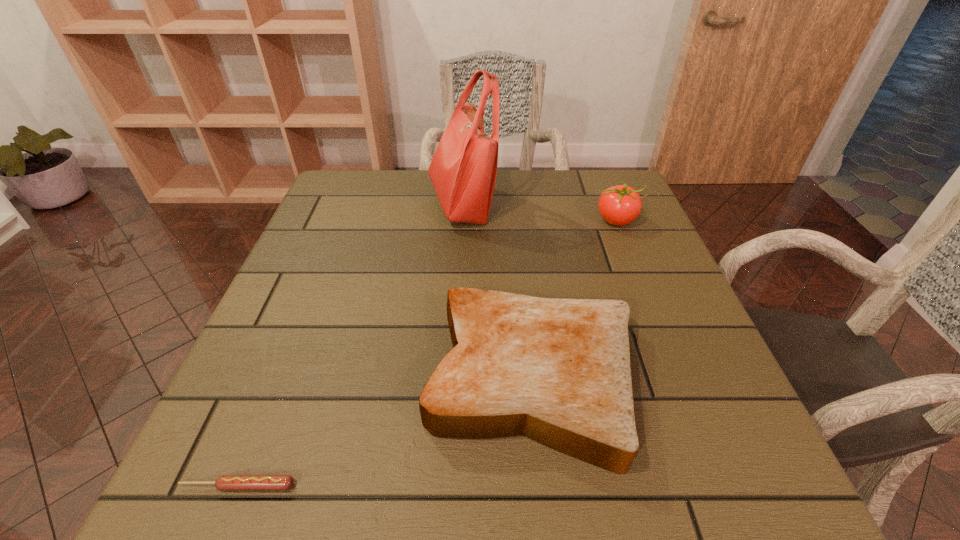
The height and width of the screenshot is (540, 960). Identify the location of vacant space situated on the back of the sausage. [304, 320].

Locate an element on the screen. This screenshot has height=540, width=960. handbag located in the far edge section of the desktop is located at coordinates (463, 170).

Where is `tomato that is at the far edge`? The height and width of the screenshot is (540, 960). tomato that is at the far edge is located at coordinates (619, 205).

Identify the location of bread present at the near edge. Image resolution: width=960 pixels, height=540 pixels. (x=557, y=371).

You are a GUI agent. You are given a task and a screenshot of the screen. Output one action in this format:
    pyautogui.click(x=<x>, y=<y>)
    Task: Click on the sausage that is at the near edge
    
    Given the screenshot: What is the action you would take?
    pyautogui.click(x=224, y=482)

Locate an element on the screen. This screenshot has height=540, width=960. object that is at the left edge is located at coordinates (224, 482).

Locate an element on the screen. Image resolution: width=960 pixels, height=540 pixels. tomato present at the right edge is located at coordinates (619, 205).

The height and width of the screenshot is (540, 960). Find the location of `bread that is at the right edge`. bread that is at the right edge is located at coordinates (557, 371).

Identify the location of object situated at the near left corner. This screenshot has width=960, height=540. (224, 482).

Locate an element on the screen. object that is at the far right corner is located at coordinates (619, 205).